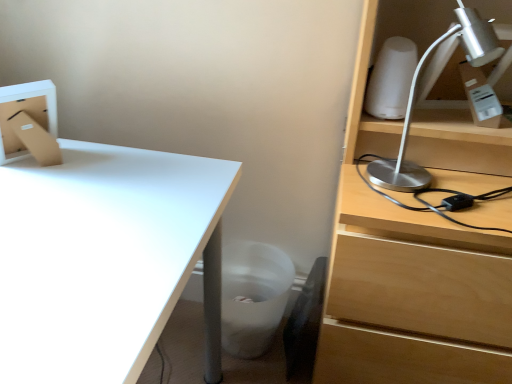
Identify the location of vacant space situated above white glossy desk at lower left (from a real-world perspective). (90, 213).